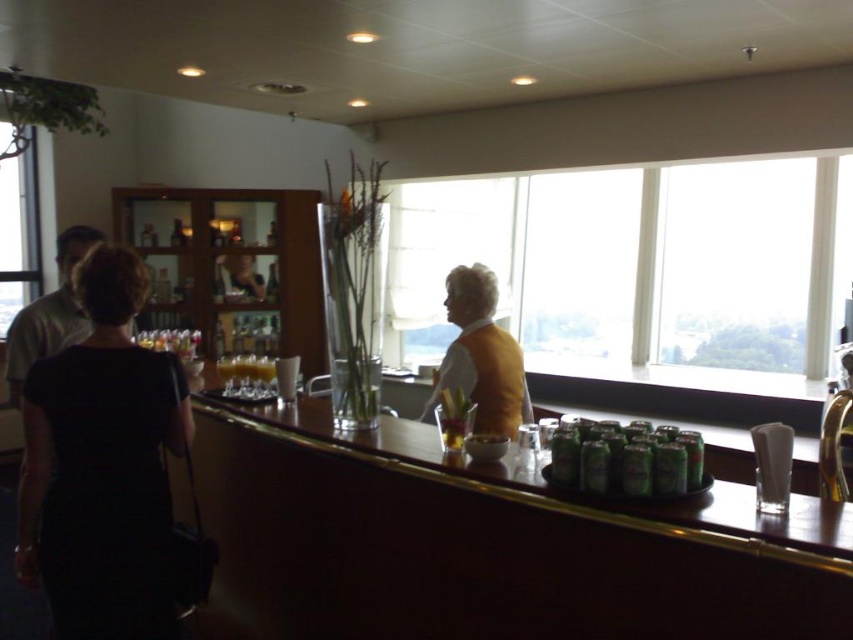
Question: Among these points, which one is nearest to the camera?

Choices:
 (A) (267, 371)
 (B) (482, 289)
 (C) (80, 525)
 (D) (844, 236)

Answer: (C)

Question: Does transparent glass window at upper center appear on the right side of translucent glass cup at bar?

Choices:
 (A) no
 (B) yes

Answer: (B)

Question: Where is matte gray shirt at left located in relation to translucent glass cup at bar in the image?

Choices:
 (A) left
 (B) right

Answer: (A)

Question: Which object is farther from the camera taking this photo?

Choices:
 (A) transparent glass window at upper center
 (B) green metallic cans at center

Answer: (A)

Question: Does black dress at left appear under green metallic cans at center?

Choices:
 (A) yes
 (B) no

Answer: (A)

Question: Which point appears farthest from the camera in this image?

Choices:
 (A) (25, 314)
 (B) (788, 310)
 (C) (256, 362)
 (D) (585, 483)

Answer: (B)